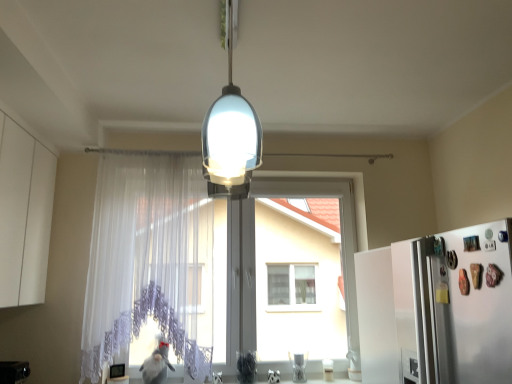
Question: From the image's perspective, is translucent glass lampshade at center over white matte cabinet at left?

Choices:
 (A) yes
 (B) no

Answer: (A)

Question: Is white matte cabinet at left completely or partially inside translucent glass lampshade at center?

Choices:
 (A) no
 (B) yes

Answer: (A)

Question: Can you confirm if translucent glass lampshade at center is shorter than white matte cabinet at left?

Choices:
 (A) yes
 (B) no

Answer: (A)

Question: Is translucent glass lampshade at center not within white matte cabinet at left?

Choices:
 (A) yes
 (B) no

Answer: (A)

Question: Is translucent glass lampshade at center looking in the opposite direction of white matte cabinet at left?

Choices:
 (A) no
 (B) yes

Answer: (A)

Question: Is white matte refrigerator at right wider or thinner than white matte cabinet at left?

Choices:
 (A) thin
 (B) wide

Answer: (B)

Question: Does point (378, 367) appear closer or farther from the camera than point (6, 301)?

Choices:
 (A) farther
 (B) closer

Answer: (A)

Question: From the image's perspective, is white matte refrigerator at right above or below white matte cabinet at left?

Choices:
 (A) below
 (B) above

Answer: (A)

Question: Is white matte refrigerator at right taller or shorter than white matte cabinet at left?

Choices:
 (A) tall
 (B) short

Answer: (B)

Question: Based on their positions, is translucent glass lampshade at center located to the left or right of transparent lace curtain at center?

Choices:
 (A) left
 (B) right

Answer: (B)

Question: Choose the correct answer: Is translucent glass lampshade at center inside transparent lace curtain at center or outside it?

Choices:
 (A) outside
 (B) inside

Answer: (A)

Question: From the image's perspective, is translucent glass lampshade at center located above or below transparent lace curtain at center?

Choices:
 (A) below
 (B) above

Answer: (B)

Question: Considering the positions of translucent glass lampshade at center and transparent lace curtain at center in the image, is translucent glass lampshade at center wider or thinner than transparent lace curtain at center?

Choices:
 (A) thin
 (B) wide

Answer: (B)

Question: Considering the positions of point (441, 294) and point (227, 1), is point (441, 294) closer or farther from the camera than point (227, 1)?

Choices:
 (A) farther
 (B) closer

Answer: (A)

Question: Looking at their shapes, would you say white matte refrigerator at right is wider or thinner than translucent glass lampshade at center?

Choices:
 (A) thin
 (B) wide

Answer: (B)